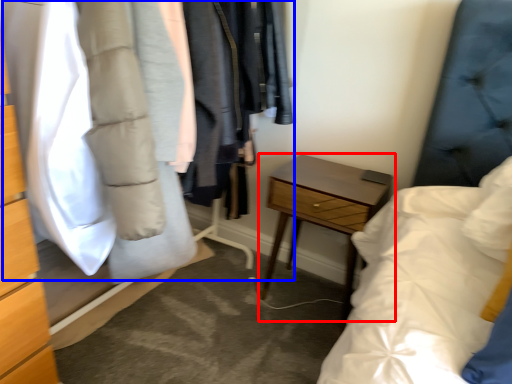
Question: Which point is closer to the camera, nightstand (highlighted by a red box) or closet (highlighted by a blue box)?

Choices:
 (A) nightstand
 (B) closet

Answer: (B)